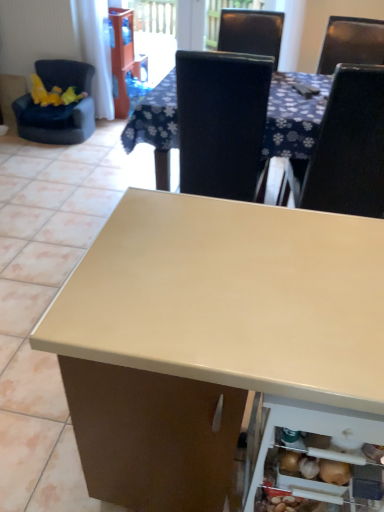
Question: Considering the relative sizes of velvet-like black armchair at left, which is the 1th chair from top to bottom, and white plastic shelf at lower right in the image provided, is velvet-like black armchair at left, which is the 1th chair from top to bottom, shorter than white plastic shelf at lower right?

Choices:
 (A) no
 (B) yes

Answer: (A)

Question: Is velvet-like black armchair at left, the 2th chair positioned from the bottom, smaller than white plastic shelf at lower right?

Choices:
 (A) no
 (B) yes

Answer: (A)

Question: From a real-world perspective, is velvet-like black armchair at left, the 2th chair positioned from the bottom, under white plastic shelf at lower right?

Choices:
 (A) yes
 (B) no

Answer: (A)

Question: Is velvet-like black armchair at left, which ranks as the second chair in front-to-back order, taller than white plastic shelf at lower right?

Choices:
 (A) yes
 (B) no

Answer: (A)

Question: Is the position of velvet-like black armchair at left, which is the 1th chair from back to front, less distant than that of white plastic shelf at lower right?

Choices:
 (A) yes
 (B) no

Answer: (B)

Question: Considering the positions of black leather chair at upper right, arranged as the 2th chair when viewed from the top, and white fabric curtain at upper left in the image, is black leather chair at upper right, arranged as the 2th chair when viewed from the top, wider or thinner than white fabric curtain at upper left?

Choices:
 (A) wide
 (B) thin

Answer: (A)

Question: In the image, is black leather chair at upper right, which appears as the 1th chair when viewed from the front, on the left side or the right side of white fabric curtain at upper left?

Choices:
 (A) right
 (B) left

Answer: (A)

Question: From a real-world perspective, is black leather chair at upper right, marked as the 1th chair in a right-to-left arrangement, physically located above or below white fabric curtain at upper left?

Choices:
 (A) above
 (B) below

Answer: (A)

Question: In the image, is black leather chair at upper right, the second chair from the back, positioned in front of or behind white fabric curtain at upper left?

Choices:
 (A) behind
 (B) front

Answer: (B)

Question: In terms of width, does transparent plastic screen door at upper center look wider or thinner when compared to velvet-like black armchair at left, which ranks as the second chair in front-to-back order?

Choices:
 (A) wide
 (B) thin

Answer: (B)

Question: Is transparent plastic screen door at upper center spatially inside velvet-like black armchair at left, which ranks as the second chair in front-to-back order, or outside of it?

Choices:
 (A) outside
 (B) inside

Answer: (A)

Question: In terms of size, does transparent plastic screen door at upper center appear bigger or smaller than velvet-like black armchair at left, marked as the 2th chair in a right-to-left arrangement?

Choices:
 (A) big
 (B) small

Answer: (B)

Question: Does point (139, 45) appear closer or farther from the camera than point (66, 74)?

Choices:
 (A) farther
 (B) closer

Answer: (A)

Question: Considering the positions of velvet-like black armchair at left, which is counted as the 1th chair, starting from the left, and transparent plastic screen door at upper center in the image, is velvet-like black armchair at left, which is counted as the 1th chair, starting from the left, bigger or smaller than transparent plastic screen door at upper center?

Choices:
 (A) big
 (B) small

Answer: (A)

Question: Considering the positions of point (89, 117) and point (135, 16), is point (89, 117) closer or farther from the camera than point (135, 16)?

Choices:
 (A) closer
 (B) farther

Answer: (A)